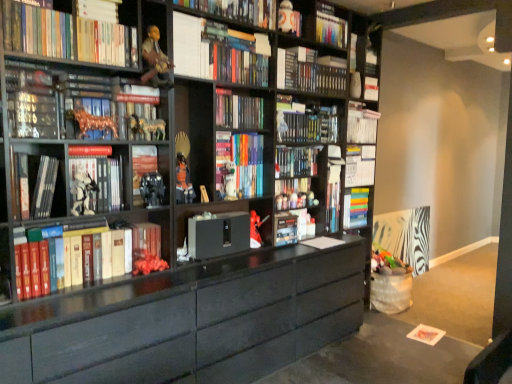
How much space does matte plastic figurine at center, positioned as the 12th book in top-to-bottom order, occupy horizontally?

matte plastic figurine at center, positioned as the 12th book in top-to-bottom order, is 5.52 inches in width.

Describe the element at coordinates (314, 23) in the screenshot. The image size is (512, 384). I see `multicolored bookshelf at upper center` at that location.

The width and height of the screenshot is (512, 384). In order to click on hardcover books at left, the fourteenth book positioned from the top in this screenshot , I will do `click(83, 255)`.

This screenshot has height=384, width=512. I want to click on rubber matte toy at center, placed as the fifth toy when sorted from top to bottom, so click(147, 263).

At what (x,y) coordinates should I click in order to perform the action: click on multicolored hardcover books at center, placed as the ninth book when sorted from bottom to top. Please return your answer as a coordinate pair (x, y). The height and width of the screenshot is (384, 512). Looking at the image, I should click on (238, 110).

Considering the sizes of objects multicolored hardcover books at center, acting as the 6th book starting from the top, and white plastic toy at upper center, the fifth toy positioned from the front, in the image provided, who is wider, multicolored hardcover books at center, acting as the 6th book starting from the top, or white plastic toy at upper center, the fifth toy positioned from the front,?

multicolored hardcover books at center, acting as the 6th book starting from the top, is wider.

Can you confirm if multicolored hardcover books at center, acting as the 6th book starting from the top, is taller than white plastic toy at upper center, which is the first toy in back-to-front order?

No, multicolored hardcover books at center, acting as the 6th book starting from the top, is not taller than white plastic toy at upper center, which is the first toy in back-to-front order.

From the image's perspective, is multicolored hardcover books at center, acting as the 6th book starting from the top, above or below white plastic toy at upper center, the fifth toy positioned from the front?

Clearly, from the image's perspective, multicolored hardcover books at center, acting as the 6th book starting from the top, is below white plastic toy at upper center, the fifth toy positioned from the front.

In the scene shown: Between matte black figurine at upper left, the 8th book ordered from the bottom, and multicolored hardcover books at center, placed as the 2th book when sorted from bottom to top, which one has larger size?

Bigger between the two is multicolored hardcover books at center, placed as the 2th book when sorted from bottom to top.

Can multicolored hardcover books at center, which ranks as the thirteenth book in top-to-bottom order, be found inside matte black figurine at upper left, the 8th book ordered from the bottom?

Actually, multicolored hardcover books at center, which ranks as the thirteenth book in top-to-bottom order, is outside matte black figurine at upper left, the 8th book ordered from the bottom.

Is matte black figurine at upper left, the seventh book positioned from the top, far away from multicolored hardcover books at center, placed as the 2th book when sorted from bottom to top?

Yes.

Considering the sizes of objects matte black figurine at upper left, the 8th book ordered from the bottom, and multicolored hardcover books at center, which ranks as the thirteenth book in top-to-bottom order, in the image provided, who is thinner, matte black figurine at upper left, the 8th book ordered from the bottom, or multicolored hardcover books at center, which ranks as the thirteenth book in top-to-bottom order,?

matte black figurine at upper left, the 8th book ordered from the bottom, is thinner.

In the scene shown: Is white matte figure at left, which is the 10th book from top to bottom, at the back of matte black cabinet at center?

matte black cabinet at center does not have its back to white matte figure at left, which is the 10th book from top to bottom.

Based on the photo, would you say matte black cabinet at center is to the left or to the right of white matte figure at left, the fifth book ordered from the bottom, in the picture?

matte black cabinet at center is to the right of white matte figure at left, the fifth book ordered from the bottom.

In terms of height, does matte black cabinet at center look taller or shorter compared to white matte figure at left, which is the 10th book from top to bottom?

Considering their sizes, matte black cabinet at center has less height than white matte figure at left, which is the 10th book from top to bottom.

Does matte black cabinet at center have a larger size compared to white matte figure at left, which is the 10th book from top to bottom?

Yes.

Is matte plastic figurine at center, positioned as the 12th book in top-to-bottom order, not close to hardcover book at left, the eleventh book in the top-to-bottom sequence?

Yes, matte plastic figurine at center, positioned as the 12th book in top-to-bottom order, and hardcover book at left, the eleventh book in the top-to-bottom sequence, are located far from each other.

Which is in front, point (298, 191) or point (27, 176)?

The point (27, 176) is closer.

Where is `the 1st book above when counting from the matte plastic figurine at center, positioned as the 12th book in top-to-bottom order (from the image's perspective)`? Image resolution: width=512 pixels, height=384 pixels. the 1st book above when counting from the matte plastic figurine at center, positioned as the 12th book in top-to-bottom order (from the image's perspective) is located at coordinates (34, 184).

Consider the image. Which of these two, matte plastic figurine at center, which ranks as the third book in bottom-to-top order, or hardcover book at left, positioned as the 4th book in bottom-to-top order, is bigger?

With larger size is matte plastic figurine at center, which ranks as the third book in bottom-to-top order.

Are hardcover book at upper center, positioned as the first book in top-to-bottom order, and matte black figurine at upper left, the seventh book positioned from the top, far apart?

hardcover book at upper center, positioned as the first book in top-to-bottom order, is actually quite close to matte black figurine at upper left, the seventh book positioned from the top.

From the picture: Can you confirm if hardcover book at upper center, positioned as the 14th book in bottom-to-top order, is positioned to the left of matte black figurine at upper left, the 8th book ordered from the bottom?

No.

Find the location of a particular element. Image resolution: width=512 pixels, height=384 pixels. the 2nd book in front of the hardcover book at upper center, positioned as the first book in top-to-bottom order is located at coordinates (88, 86).

Who is smaller, hardcover book at upper center, positioned as the 14th book in bottom-to-top order, or matte black figurine at upper left, the seventh book positioned from the top?

Smaller between the two is matte black figurine at upper left, the seventh book positioned from the top.

Is matte black bookshelf at center, which is counted as the sixth book, starting from the bottom, turned away from matte black cabinet at center?

No, matte black bookshelf at center, which is counted as the sixth book, starting from the bottom, is not facing away from matte black cabinet at center.

Does matte black bookshelf at center, which is counted as the sixth book, starting from the bottom, contain matte black cabinet at center?

No, matte black bookshelf at center, which is counted as the sixth book, starting from the bottom, does not contain matte black cabinet at center.

Are matte black bookshelf at center, which is counted as the sixth book, starting from the bottom, and matte black cabinet at center beside each other?

matte black bookshelf at center, which is counted as the sixth book, starting from the bottom, and matte black cabinet at center are not in contact.

From the image's perspective, would you say matte black bookshelf at center, the 9th book positioned from the top, is positioned over matte black cabinet at center?

Yes, from the image's perspective, matte black bookshelf at center, the 9th book positioned from the top, is on top of matte black cabinet at center.

Considering the positions of point (46, 183) and point (232, 204), is point (46, 183) closer or farther from the camera than point (232, 204)?

Clearly, point (46, 183) is closer to the camera than point (232, 204).

From the image's perspective, is hardcover book at left, positioned as the 4th book in bottom-to-top order, above or below matte black cabinet at center?

Clearly, from the image's perspective, hardcover book at left, positioned as the 4th book in bottom-to-top order, is above matte black cabinet at center.

From a real-world perspective, is hardcover book at left, positioned as the 4th book in bottom-to-top order, above or below matte black cabinet at center?

hardcover book at left, positioned as the 4th book in bottom-to-top order, is situated higher than matte black cabinet at center in the real world.

From the matte black cabinet at center, count 6th books forward and point to it. Please provide its 2D coordinates.

[(34, 184)]

The width and height of the screenshot is (512, 384). In order to click on toy above the multicolored hardcover books at center, acting as the 6th book starting from the top (from the image's perspective) in this screenshot , I will do `click(289, 19)`.

At what (x,y) coordinates should I click in order to perform the action: click on the 8th book in front of the multicolored hardcover books at center, placed as the 2th book when sorted from bottom to top. Please return your answer as a coordinate pair (x, y). The height and width of the screenshot is (384, 512). Looking at the image, I should click on (88, 86).

Based on their spatial positions, is matte black cabinet at center or matte plastic figurine at center, positioned as the 12th book in top-to-bottom order, closer to hardcover books at left, the fourteenth book positioned from the top?

matte black cabinet at center.

When comparing their distances from white plastic toy at upper center, the 1th toy when ordered from top to bottom, does multicolored hardcover books at center, placed as the 2th book when sorted from bottom to top, or hardcover book at upper center, positioned as the 14th book in bottom-to-top order, seem closer?

hardcover book at upper center, positioned as the 14th book in bottom-to-top order, is positioned closer to the anchor white plastic toy at upper center, the 1th toy when ordered from top to bottom.

Based on their spatial positions, is multicolored hardcover books at center, acting as the 6th book starting from the top, or matte black cabinet at center closer to hardcover book at upper center, positioned as the first book in top-to-bottom order?

Among the two, multicolored hardcover books at center, acting as the 6th book starting from the top, is located nearer to hardcover book at upper center, positioned as the first book in top-to-bottom order.

Based on their spatial positions, is white plastic toy at upper center, which ranks as the first toy in right-to-left order, or hardcover book at left, the eleventh book in the top-to-bottom sequence, further from matte black bookshelf at center, which is counted as the sixth book, starting from the bottom?

Among the two, hardcover book at left, the eleventh book in the top-to-bottom sequence, is located further to matte black bookshelf at center, which is counted as the sixth book, starting from the bottom.

Considering their positions, is multicolored hardcover books at center, acting as the 6th book starting from the top, positioned closer to hardcover books at left, the fourteenth book positioned from the top, than matte black cabinet at center?

Among the two, matte black cabinet at center is located nearer to hardcover books at left, the fourteenth book positioned from the top.

Consider the image. Which object lies further to the anchor point matte black figurine at center, the fifth toy from the right, hardcover books at left, the first book from the bottom, or matte black bookshelf at center, the 9th book positioned from the top?

Based on the image, matte black bookshelf at center, the 9th book positioned from the top, appears to be further to matte black figurine at center, the fifth toy from the right.

When comparing their distances from hardcover books at left, the fourteenth book positioned from the top, does rubber matte toy at center, placed as the 3th toy when sorted from left to right, or matte black bookcase at center seem closer?

rubber matte toy at center, placed as the 3th toy when sorted from left to right, lies closer to hardcover books at left, the fourteenth book positioned from the top, than the other object.

Estimate the real-world distances between objects in this image. Which object is further from white matte figure at left, which is the 10th book from top to bottom, metallic glass at left, which is the 8th book in top-to-bottom order, or matte black figurine at upper left, the seventh book positioned from the top?

Based on the image, matte black figurine at upper left, the seventh book positioned from the top, appears to be further to white matte figure at left, which is the 10th book from top to bottom.

At what (x,y) coordinates should I click in order to perform the action: click on shelf situated between metallic gold horse at upper left, acting as the second toy starting from the top, and multicolored hardcover books at center, placed as the 2th book when sorted from bottom to top, from left to right. Please return your answer as a coordinate pair (x, y). Looking at the image, I should click on (314, 23).

Locate an element on the screen. The width and height of the screenshot is (512, 384). cabinet situated between metallic black robot at center, acting as the third toy starting from the top, and multicolored hardcover books at center, which ranks as the thirteenth book in top-to-bottom order, from left to right is located at coordinates (221, 228).

You are a GUI agent. You are given a task and a screenshot of the screen. Output one action in this format:
    pyautogui.click(x=<x>, y=<y>)
    Task: Click on the cabinet between multicolored hardcover books at center, acting as the 6th book starting from the top, and hardcover books at left, the first book from the bottom, in the up-down direction
    
    Given the screenshot: What is the action you would take?
    pyautogui.click(x=221, y=228)

Find the location of a particular element. Image resolution: width=512 pixels, height=384 pixels. cabinet between hardcover books at upper left, which is counted as the 10th book, starting from the bottom, and hardcover book at upper center, positioned as the eleventh book in bottom-to-top order, from left to right is located at coordinates (221, 228).